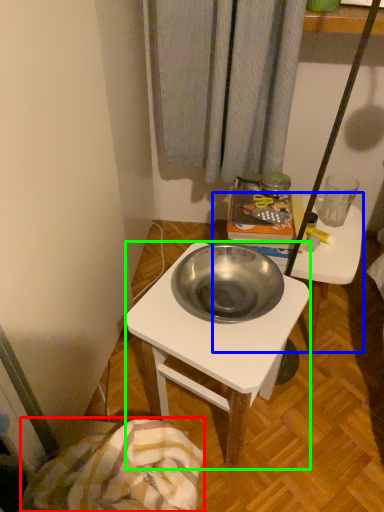
Question: Based on their relative distances, which object is nearer to blanket (highlighted by a red box)? Choose from table (highlighted by a blue box) and desk (highlighted by a green box).

Choices:
 (A) table
 (B) desk

Answer: (B)